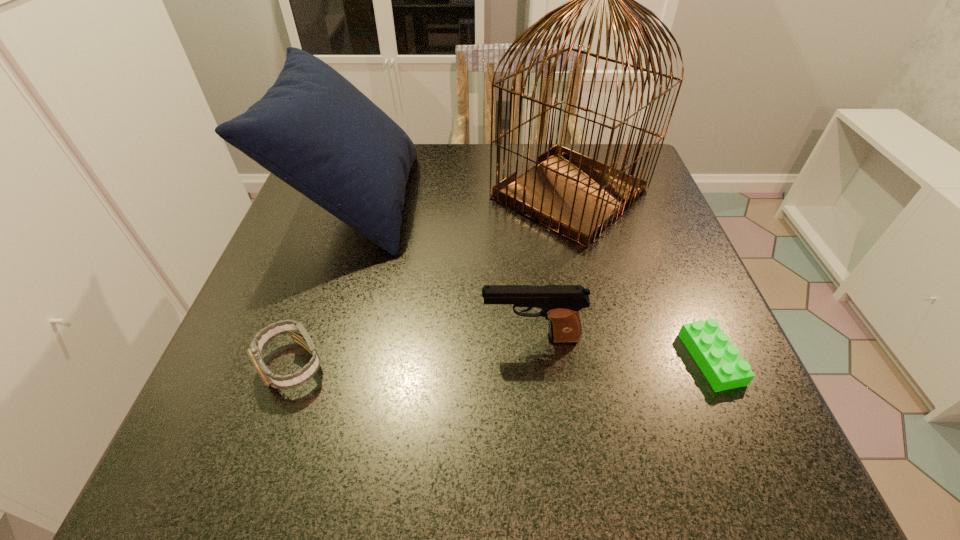
The width and height of the screenshot is (960, 540). I want to click on free point located 0.120m on the face of the fourth tallest object, so click(x=252, y=478).

The image size is (960, 540). I want to click on free space located on the left of the shortest object, so click(524, 359).

I want to click on birdcage positioned at the far edge, so click(576, 196).

Locate an element on the screen. The width and height of the screenshot is (960, 540). cushion at the far edge is located at coordinates (313, 129).

I want to click on cushion present at the left edge, so click(x=313, y=129).

Locate an element on the screen. Image resolution: width=960 pixels, height=540 pixels. watch positioned at the left edge is located at coordinates (299, 335).

Where is `birdcage positioned at the right edge`? The width and height of the screenshot is (960, 540). birdcage positioned at the right edge is located at coordinates (576, 196).

Where is `Lego at the right edge`? Lego at the right edge is located at coordinates (720, 362).

This screenshot has width=960, height=540. Find the location of `object at the far left corner`. object at the far left corner is located at coordinates (313, 129).

This screenshot has width=960, height=540. In order to click on object that is at the far right corner in this screenshot , I will do `click(576, 196)`.